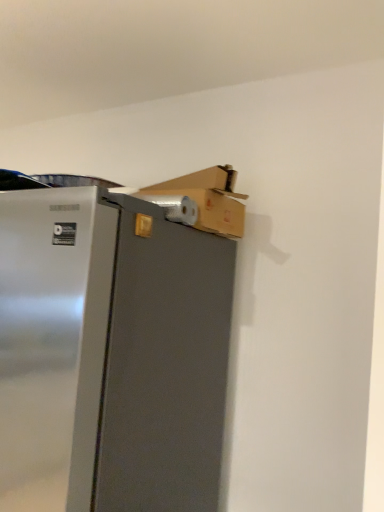
Question: In terms of height, does satin silver refrigerator at upper left look taller or shorter compared to cardboard box at upper right?

Choices:
 (A) tall
 (B) short

Answer: (A)

Question: Considering their positions, is satin silver refrigerator at upper left located in front of or behind cardboard box at upper right?

Choices:
 (A) front
 (B) behind

Answer: (A)

Question: Based on their positions, is satin silver refrigerator at upper left located to the left or right of cardboard box at upper right?

Choices:
 (A) left
 (B) right

Answer: (A)

Question: From the image's perspective, is cardboard box at upper right located above or below satin silver refrigerator at upper left?

Choices:
 (A) above
 (B) below

Answer: (A)

Question: Is cardboard box at upper right inside the boundaries of satin silver refrigerator at upper left, or outside?

Choices:
 (A) outside
 (B) inside

Answer: (A)

Question: Looking at the image, does cardboard box at upper right seem bigger or smaller compared to satin silver refrigerator at upper left?

Choices:
 (A) small
 (B) big

Answer: (A)

Question: Is cardboard box at upper right taller or shorter than satin silver refrigerator at upper left?

Choices:
 (A) short
 (B) tall

Answer: (A)